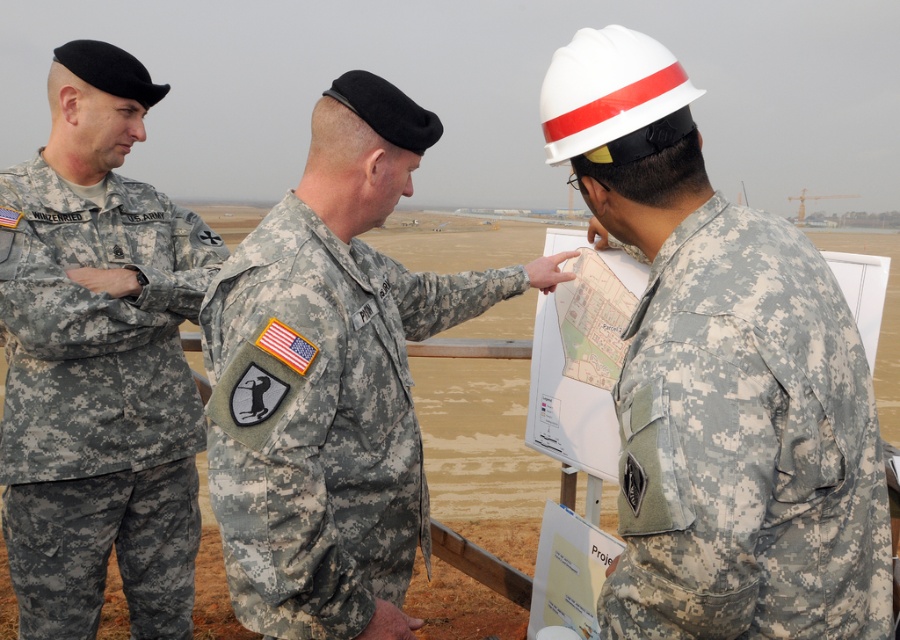
Question: Based on their relative distances, which object is farther from the camouflage fabric uniform at right?

Choices:
 (A) camouflage fabric uniform at left
 (B) camouflage fabric uniform at center

Answer: (A)

Question: Which of these objects is positioned farthest from the camouflage fabric uniform at right?

Choices:
 (A) camouflage fabric uniform at center
 (B) camouflage fabric uniform at left

Answer: (B)

Question: Considering the relative positions of camouflage fabric uniform at right and camouflage fabric uniform at left in the image provided, where is camouflage fabric uniform at right located with respect to camouflage fabric uniform at left?

Choices:
 (A) above
 (B) below

Answer: (A)

Question: Is camouflage fabric uniform at right positioned behind camouflage fabric uniform at left?

Choices:
 (A) yes
 (B) no

Answer: (B)

Question: Does camouflage fabric uniform at right have a larger size compared to camouflage fabric uniform at left?

Choices:
 (A) no
 (B) yes

Answer: (A)

Question: Which point is farther to the camera?

Choices:
 (A) (118, 204)
 (B) (383, 442)

Answer: (A)